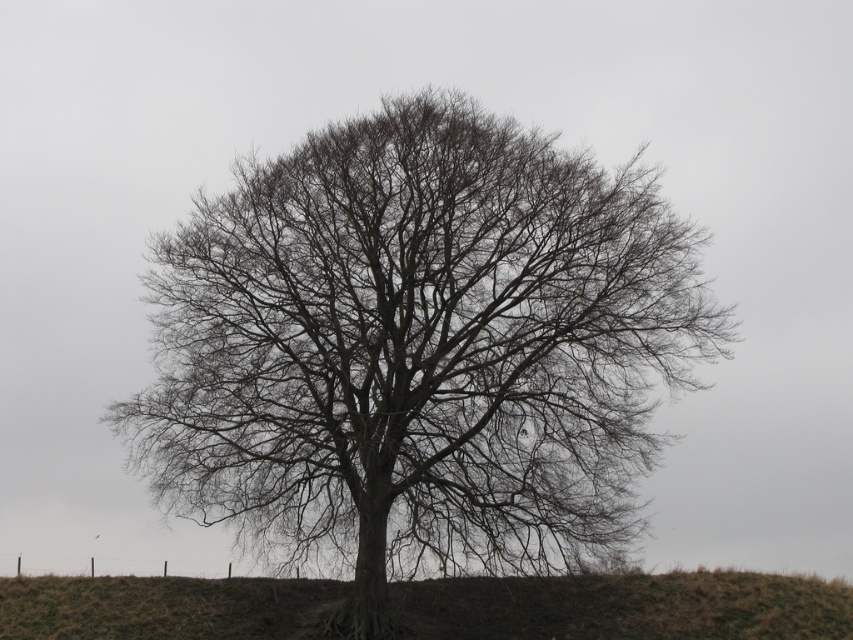
From the picture: You are standing 60 feet away from a tree with bare branches at center. You want to throw a ball to hit the branches. Will the distance be sufficient?

The bare branches at center is 58.00 feet from viewer, so yes, the distance of 60 feet is sufficient to reach the branches.

You are an artist sketching the scene and want to draw the bare branches at center and the brown grassy hillside at center accurately. Which object is located to the left of the other?

The bare branches at center is positioned on the left side of brown grassy hillside at center.

You are a bird looking for a place to perch. You see the bare branches at center and the brown grassy hillside at center. Which location would allow you to reach a higher elevation?

The bare branches at center is much taller as brown grassy hillside at center, so the bare branches at center would allow you to reach a higher elevation.